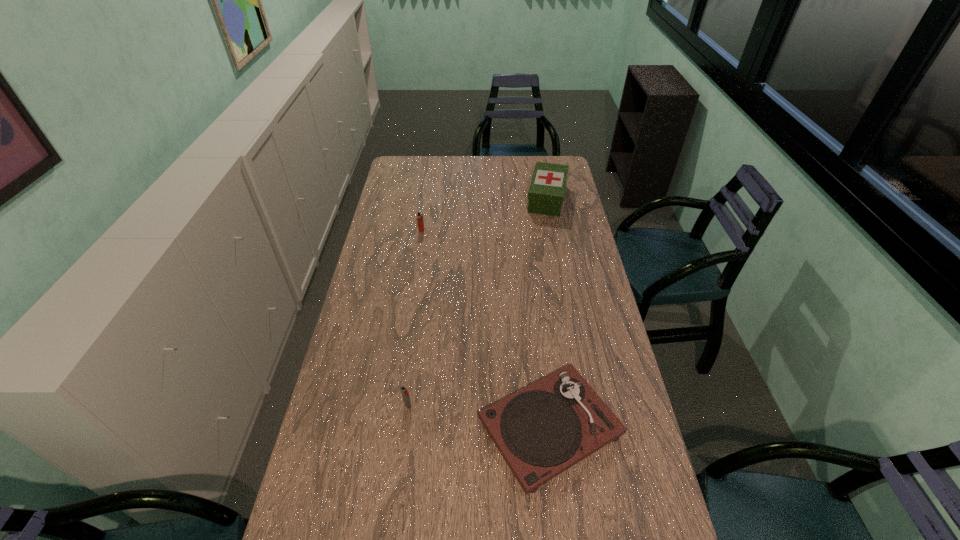
Find the location of a particular element. This screenshot has height=540, width=960. the farthest object is located at coordinates (546, 193).

The width and height of the screenshot is (960, 540). In order to click on the left igniter in this screenshot , I will do `click(420, 214)`.

Locate an element on the screen. the second farthest object is located at coordinates (420, 214).

At what (x,y) coordinates should I click in order to perform the action: click on the nearer igniter. Please return your answer as a coordinate pair (x, y). The image size is (960, 540). Looking at the image, I should click on (405, 393).

Where is `the third object from right to left`? The image size is (960, 540). the third object from right to left is located at coordinates (405, 393).

I want to click on phonograph_record, so click(x=542, y=430).

What are the coordinates of `free point located on the left of the first-aid kit` in the screenshot? It's located at click(480, 199).

Where is `vacant region located on the front of the leftmost object`? vacant region located on the front of the leftmost object is located at coordinates (413, 288).

This screenshot has width=960, height=540. Find the location of `vacant point located 0.340m on the front of the right igniter`. vacant point located 0.340m on the front of the right igniter is located at coordinates (391, 539).

Where is `vacant space positioned 0.370m on the left of the phonograph_record`? Image resolution: width=960 pixels, height=540 pixels. vacant space positioned 0.370m on the left of the phonograph_record is located at coordinates (347, 427).